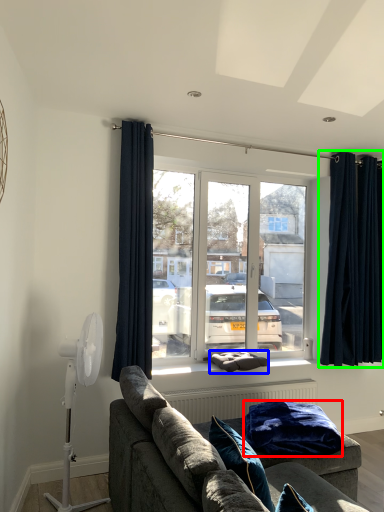
Question: Which object is positioned farthest from blanket (highlighted by a red box)? Select from pillow (highlighted by a blue box) and curtain (highlighted by a green box).

Choices:
 (A) pillow
 (B) curtain

Answer: (B)